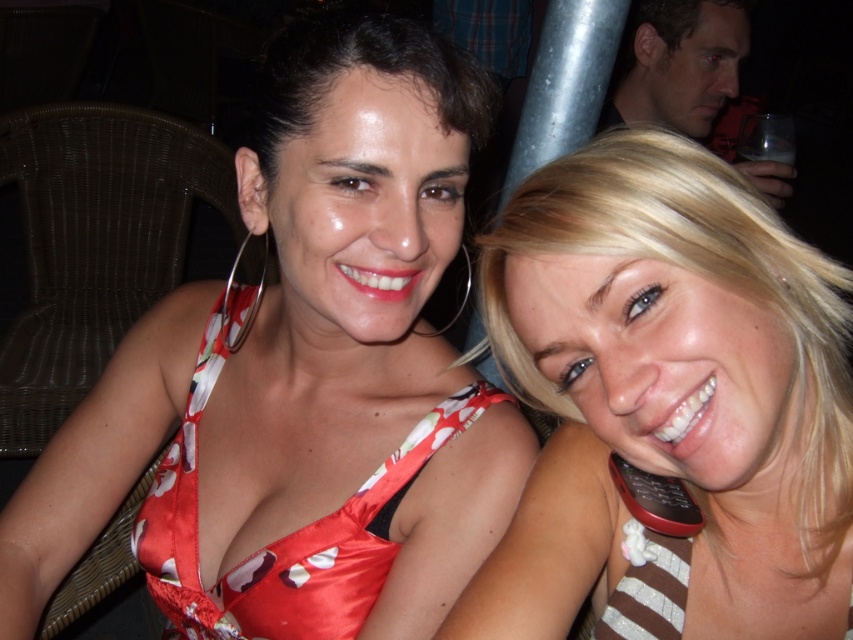
You are a photographer adjusting the camera focus. You need to ensure both the floral satin dress at center and the blonde hair at right are in focus. Which object should you adjust the focus on first to account for their size difference?

The floral satin dress at center is larger in size compared to the blonde hair at right, so you should adjust the focus on the floral satin dress at center first to ensure it is sharp before adjusting for the smaller detail of the blonde hair at right.

You are a photographer adjusting your camera settings to focus on the floral satin dress at center and the satin floral bikini top at center. Which one should you focus on first to ensure clarity in the photo?

The floral satin dress at center is closer to the viewer than the satin floral bikini top at center, so you should focus on the floral satin dress at center first to ensure clarity.